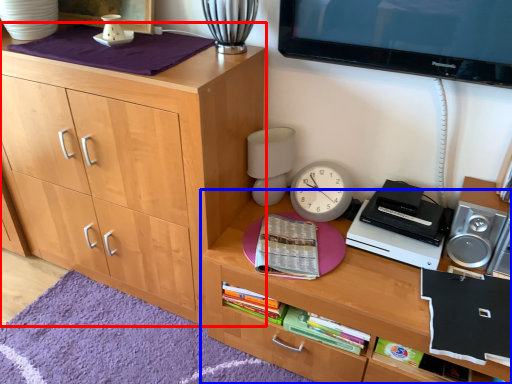
Question: Which object appears farthest to the camera in this image, cabinetry (highlighted by a red box) or desk (highlighted by a blue box)?

Choices:
 (A) cabinetry
 (B) desk

Answer: (A)